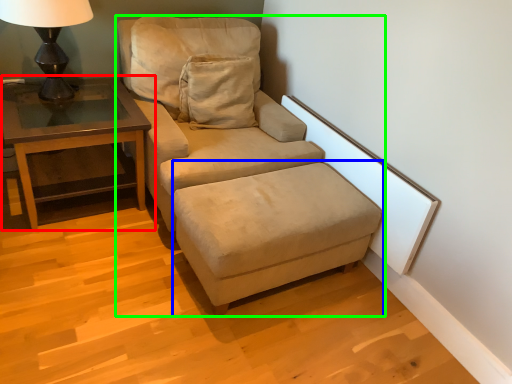
Question: Based on their relative distances, which object is farther from table (highlighted by a red box)? Choose from footrest (highlighted by a blue box) and studio couch (highlighted by a green box).

Choices:
 (A) footrest
 (B) studio couch

Answer: (A)